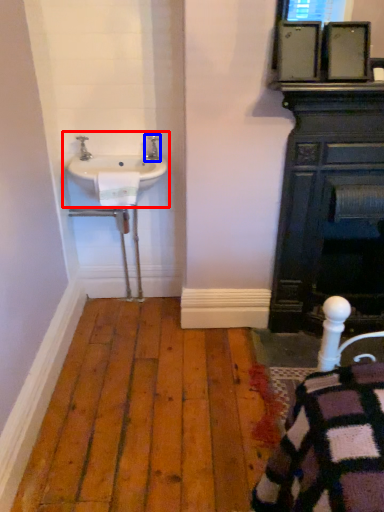
Question: Which object is further to the camera taking this photo, sink (highlighted by a red box) or tap (highlighted by a blue box)?

Choices:
 (A) sink
 (B) tap

Answer: (B)